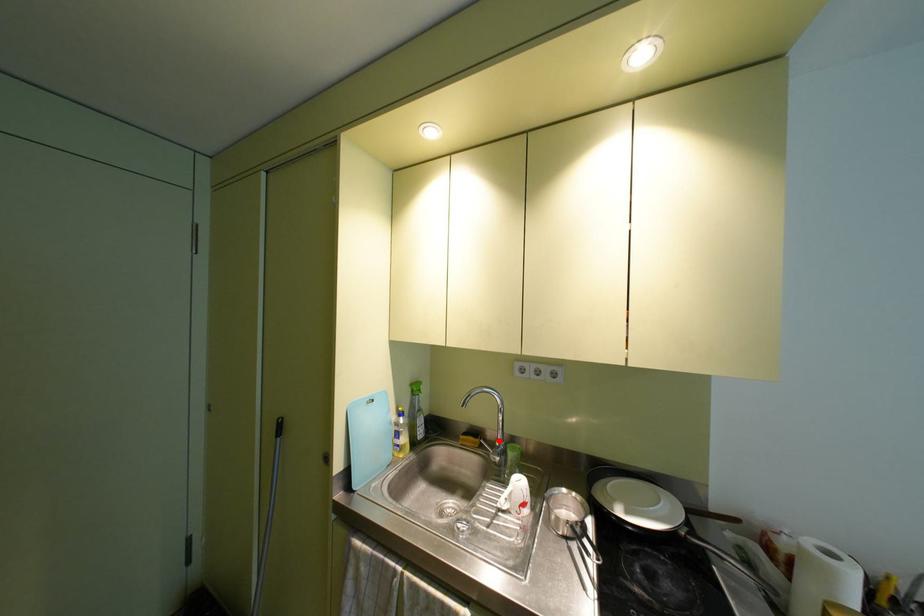
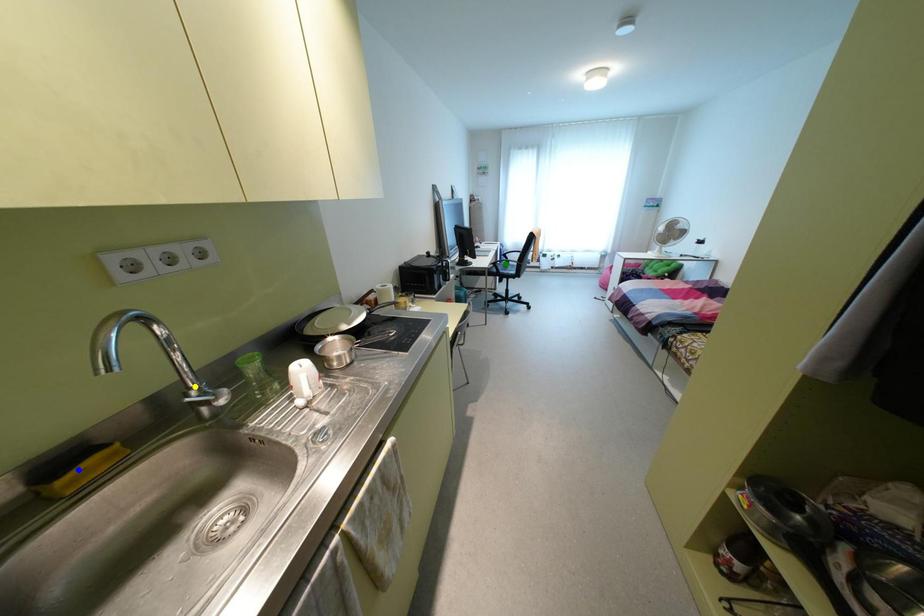
Question: I am providing you with two images of the same scene from different viewpoints. A red point is marked on the first image. You are given multiple points on the second image. Can you choose the point in image 2 that corresponds to the point in image 1?

Choices:
 (A) yellow point
 (B) green point
 (C) blue point

Answer: (A)